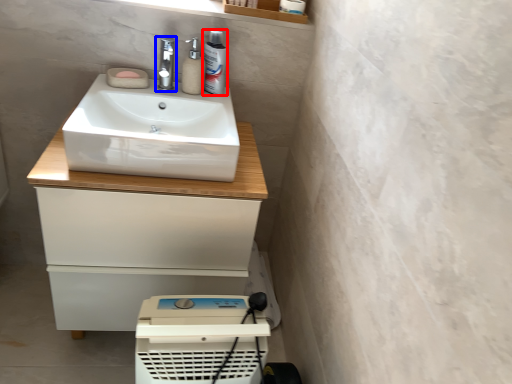
Question: Which of the following is the farthest to the observer, mouthwash (highlighted by a red box) or tap (highlighted by a blue box)?

Choices:
 (A) mouthwash
 (B) tap

Answer: (A)